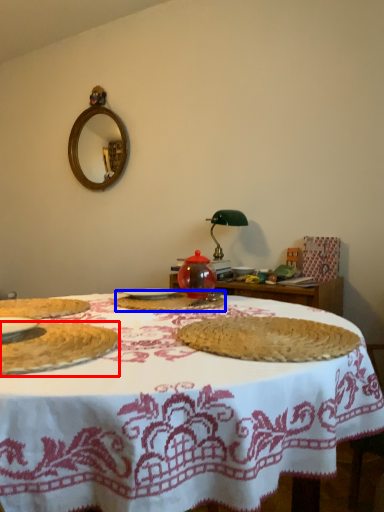
Question: Which object is further to the camera taking this photo, food (highlighted by a red box) or food (highlighted by a blue box)?

Choices:
 (A) food
 (B) food

Answer: (B)